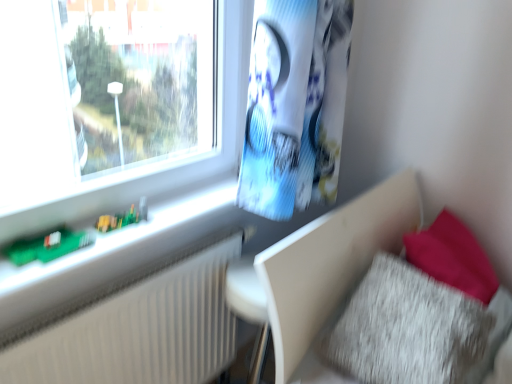
What do you see at coordinates (140, 331) in the screenshot? This screenshot has width=512, height=384. I see `white textured radiator at left` at bounding box center [140, 331].

Where is `green plastic toy at lower left`? green plastic toy at lower left is located at coordinates (123, 218).

Does white textured radiator at left have a lesser height compared to green plastic toy at lower left?

No.

From the image's perspective, is white textured radiator at left beneath green plastic toy at lower left?

Correct, white textured radiator at left appears lower than green plastic toy at lower left in the image.

Does white textured radiator at left lie in front of green plastic toy at lower left?

Yes, white textured radiator at left is in front of green plastic toy at lower left.

Is white textured radiator at left aimed at green plastic toy at lower left?

No.

How distant is green plastic toy at lower left from white textured radiator at left?

green plastic toy at lower left is 14.11 inches from white textured radiator at left.

Would you say green plastic toy at lower left is outside white textured radiator at left?

Yes, green plastic toy at lower left is outside of white textured radiator at left.

Considering the sizes of objects green plastic toy at lower left and white textured radiator at left in the image provided, who is thinner, green plastic toy at lower left or white textured radiator at left?

white textured radiator at left is thinner.

Is point (143, 199) in front of point (213, 290)?

Yes.

Considering the relative positions of fuzzy fabric pillow at lower right and white textured radiator at left in the image provided, is fuzzy fabric pillow at lower right to the left of white textured radiator at left from the viewer's perspective?

Incorrect, fuzzy fabric pillow at lower right is not on the left side of white textured radiator at left.

Which point is more forward, (434, 378) or (66, 337)?

The point (66, 337) is in front.

Considering the sizes of objects fuzzy fabric pillow at lower right and white textured radiator at left in the image provided, who is wider, fuzzy fabric pillow at lower right or white textured radiator at left?

Wider between the two is fuzzy fabric pillow at lower right.

How different are the orientations of fuzzy fabric pillow at lower right and white textured radiator at left in degrees?

They differ by 0.689 degrees in their facing directions.

Is green circuit board at left facing away from green plastic toy at lower left?

Correct, green circuit board at left is looking away from green plastic toy at lower left.

Would you say green circuit board at left is a long distance from green plastic toy at lower left?

They are positioned close to each other.

From the picture: Is green circuit board at left located outside green plastic toy at lower left?

green circuit board at left is positioned outside green plastic toy at lower left.

Considering the relative sizes of green circuit board at left and green plastic toy at lower left in the image provided, is green circuit board at left wider than green plastic toy at lower left?

Indeed, green circuit board at left has a greater width compared to green plastic toy at lower left.

Which is in front, white textured radiator at left or green circuit board at left?

green circuit board at left is in front.

Between point (183, 335) and point (170, 239), which one is positioned in front?

Positioned in front is point (170, 239).

Are green circuit board at left and white textured radiator at left making contact?

green circuit board at left is not next to white textured radiator at left, and they're not touching.

Is green circuit board at left taller than white textured radiator at left?

Incorrect, the height of green circuit board at left is not larger of that of white textured radiator at left.

Would you say green circuit board at left contains white textured radiator at left?

That's incorrect, white textured radiator at left is not inside green circuit board at left.

From the image's perspective, is green circuit board at left positioned above or below white textured radiator at left?

Based on their image positions, green circuit board at left is located above white textured radiator at left.

Is white textured radiator at left spatially inside fuzzy fabric pillow at lower right, or outside of it?

white textured radiator at left lies outside fuzzy fabric pillow at lower right.

Looking at this image, considering the sizes of objects white textured radiator at left and fuzzy fabric pillow at lower right in the image provided, who is bigger, white textured radiator at left or fuzzy fabric pillow at lower right?

With larger size is fuzzy fabric pillow at lower right.

Locate an element on the screen. The height and width of the screenshot is (384, 512). pillow above the white textured radiator at left (from a real-world perspective) is located at coordinates (407, 328).

Identify the location of radiator in front of the green plastic toy at lower left. This screenshot has height=384, width=512. (140, 331).

This screenshot has height=384, width=512. I want to click on toy that appears above the white textured radiator at left (from a real-world perspective), so click(123, 218).

Which object lies further to the anchor point fuzzy fabric pillow at lower right, white textured radiator at left or green plastic toy at lower left?

green plastic toy at lower left is positioned further to the anchor fuzzy fabric pillow at lower right.

Which object lies nearer to the anchor point green plastic toy at lower left, green circuit board at left or fuzzy fabric pillow at lower right?

green circuit board at left.

Looking at the image, which one is located further to green plastic toy at lower left, fuzzy fabric pillow at lower right or white textured radiator at left?

Among the two, fuzzy fabric pillow at lower right is located further to green plastic toy at lower left.

Based on their spatial positions, is fuzzy fabric pillow at lower right or green circuit board at left closer to green plastic toy at lower left?

Based on the image, green circuit board at left appears to be nearer to green plastic toy at lower left.

From the image, which object appears to be farther from white textured radiator at left, green circuit board at left or green plastic toy at lower left?

green plastic toy at lower left is positioned further to the anchor white textured radiator at left.

When comparing their distances from white textured radiator at left, does green plastic toy at lower left or fuzzy fabric pillow at lower right seem further?

Among the two, fuzzy fabric pillow at lower right is located further to white textured radiator at left.

Which object lies nearer to the anchor point fuzzy fabric pillow at lower right, green circuit board at left or white textured radiator at left?

Based on the image, white textured radiator at left appears to be nearer to fuzzy fabric pillow at lower right.

Consider the image. From the image, which object appears to be nearer to green circuit board at left, green plastic toy at lower left or fuzzy fabric pillow at lower right?

green plastic toy at lower left is positioned closer to the anchor green circuit board at left.

Locate an element on the screen. radiator located between green plastic toy at lower left and fuzzy fabric pillow at lower right in the left-right direction is located at coordinates (140, 331).

At what (x,y) coordinates should I click in order to perform the action: click on window sill between white textured radiator at left and fuzzy fabric pillow at lower right. Please return your answer as a coordinate pair (x, y). This screenshot has width=512, height=384. Looking at the image, I should click on click(x=128, y=243).

The width and height of the screenshot is (512, 384). I want to click on window sill that lies between green plastic toy at lower left and white textured radiator at left from top to bottom, so click(128, 243).

You are a GUI agent. You are given a task and a screenshot of the screen. Output one action in this format:
    pyautogui.click(x=<x>, y=<y>)
    Task: Click on the window sill between green plastic toy at lower left and fuzzy fabric pillow at lower right in the horizontal direction
    
    Given the screenshot: What is the action you would take?
    pyautogui.click(x=128, y=243)